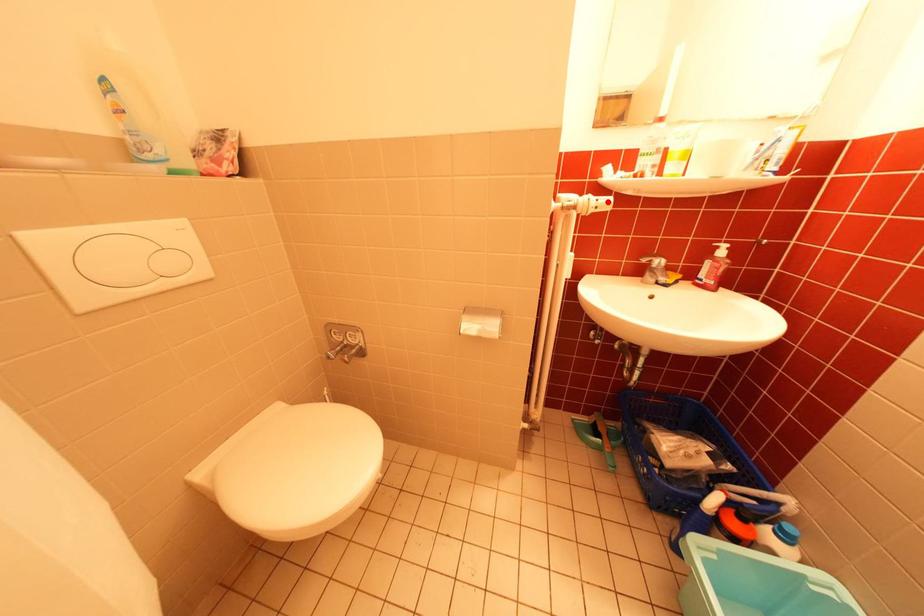
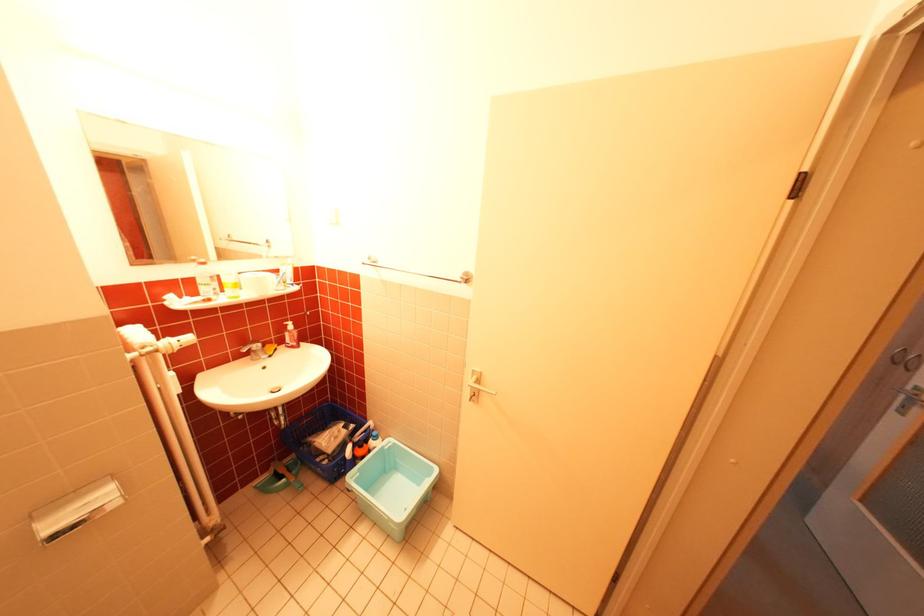
Where in the second image is the point corresponding to the highlighted location from the first image?

(189, 342)